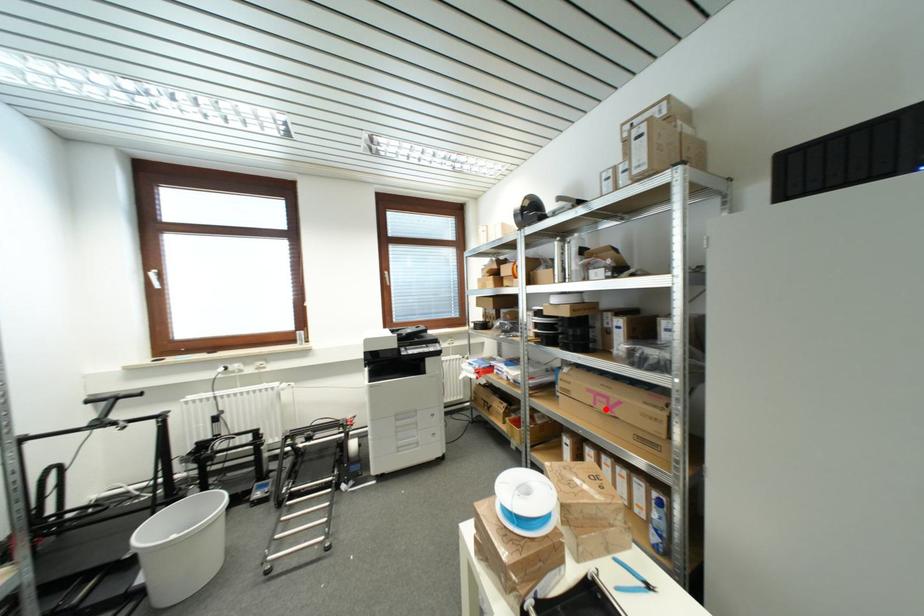
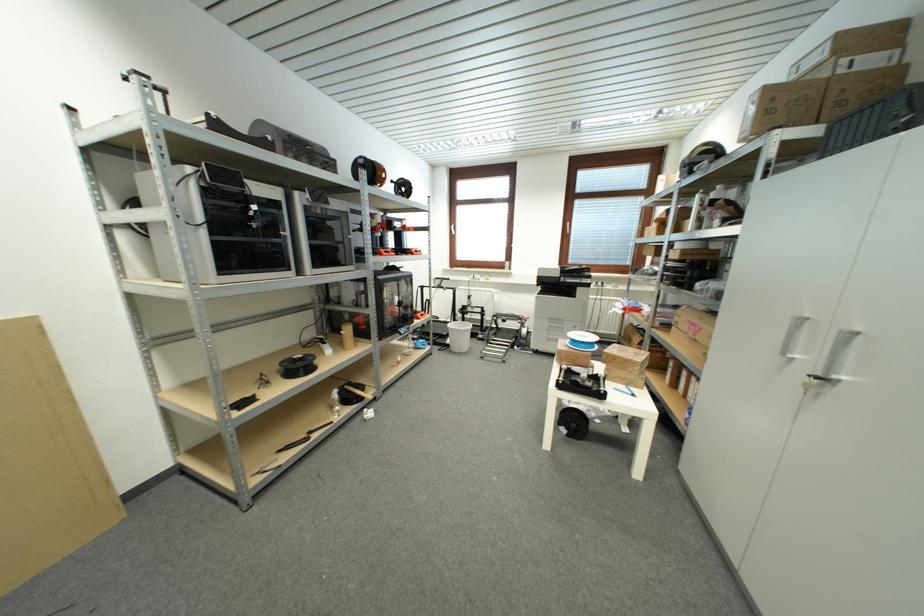
Question: I am providing you with two images of the same scene from different viewpoints. Given a red point in image1, look at the same physical point in image2. Is it:

Choices:
 (A) Closer to the viewpoint
 (B) Farther from the viewpoint

Answer: (A)